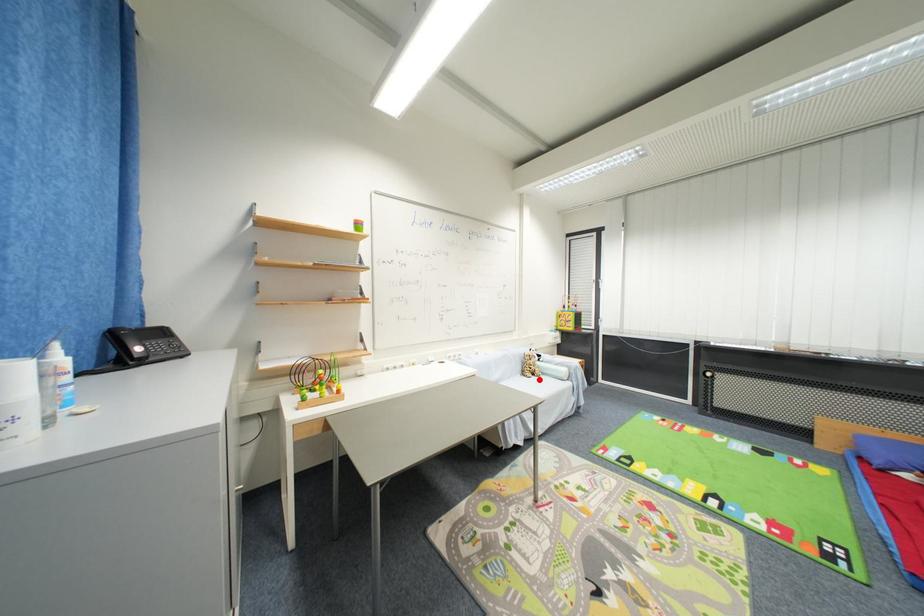
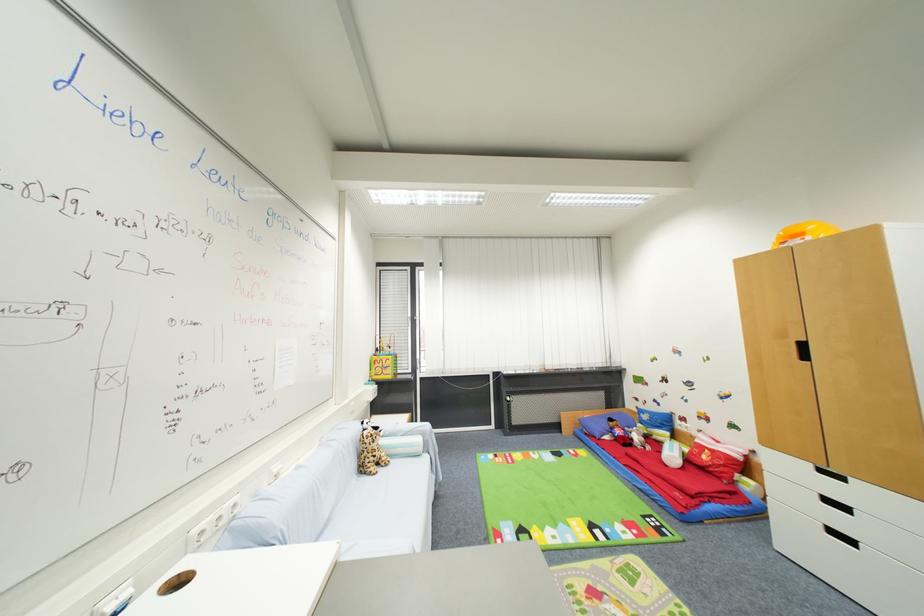
Question: I am providing you with two images of the same scene from different viewpoints. A red point is marked on the first image. Can you still see the location of the red point in image 2?

Choices:
 (A) Yes
 (B) No

Answer: (A)